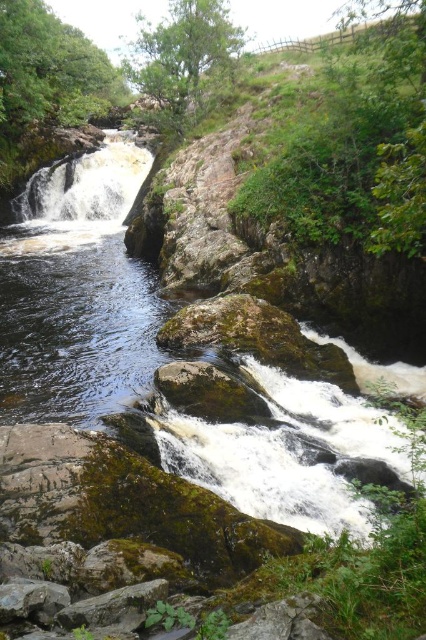
Question: Which of the following is the closest to the observer?

Choices:
 (A) gray rock at lower left
 (B) white frothy water at center
 (C) green mossy rock at center

Answer: (A)

Question: Is brown mossy rock at center to the right of green mossy rock at center from the viewer's perspective?

Choices:
 (A) no
 (B) yes

Answer: (A)

Question: Which object is farther from the camera taking this photo?

Choices:
 (A) gray rock at lower left
 (B) brown mossy rock at center
 (C) white frothy water at center
 (D) green mossy rock at center

Answer: (C)

Question: In this image, where is white frothy water at center located relative to gray rock at lower left?

Choices:
 (A) left
 (B) right

Answer: (A)

Question: Is brown mossy rock at center to the left of green mossy rock at center from the viewer's perspective?

Choices:
 (A) no
 (B) yes

Answer: (B)

Question: Estimate the real-world distances between objects in this image. Which object is farther from the white frothy water at center?

Choices:
 (A) gray rock at lower left
 (B) brown mossy rock at center

Answer: (A)